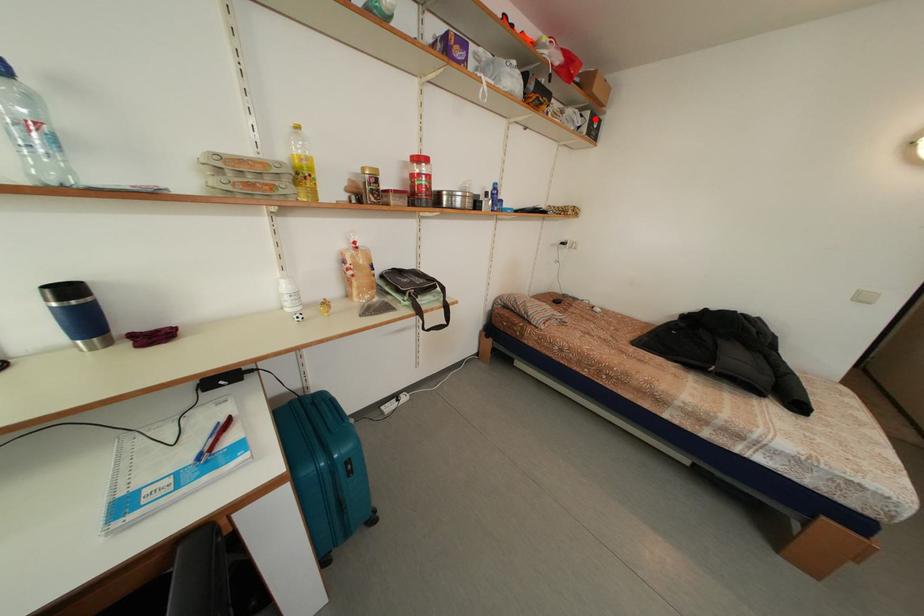
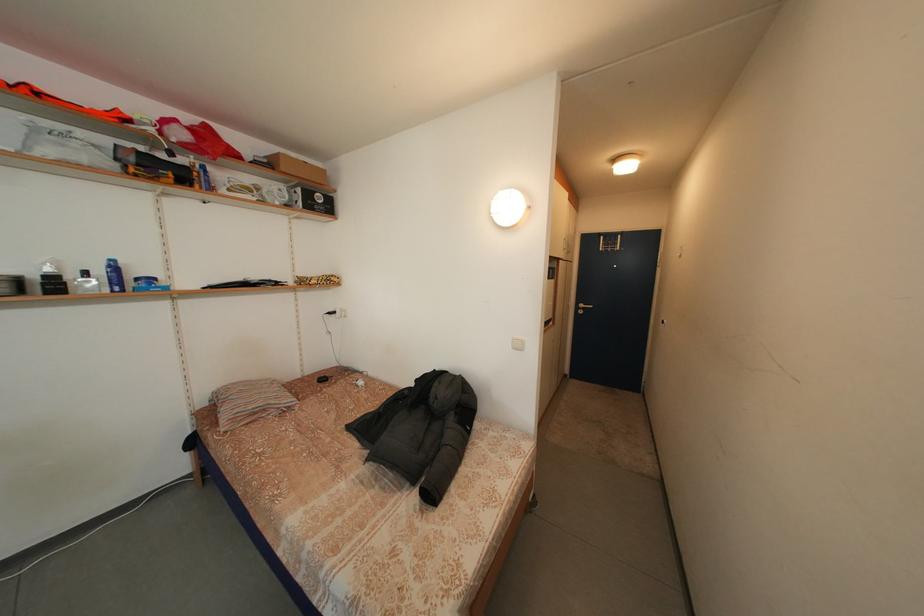
The point at the highlighted location is marked in the first image. Where is the corresponding point in the second image?

(307, 196)